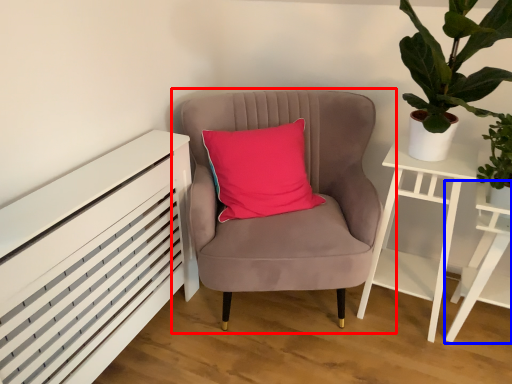
Question: Which of the following is the farthest to the observer, chair (highlighted by a red box) or table (highlighted by a blue box)?

Choices:
 (A) chair
 (B) table

Answer: (B)